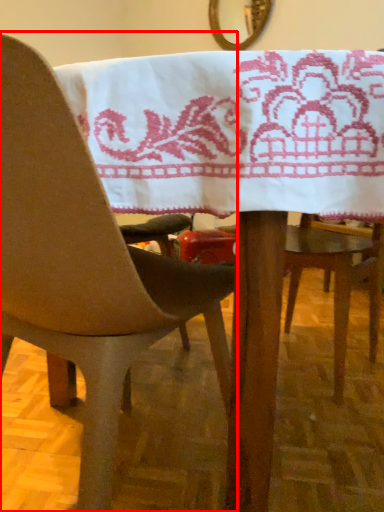
Question: From the image, what is the correct spatial relationship of chair (annotated by the red box) in relation to mirror?

Choices:
 (A) left
 (B) right

Answer: (A)